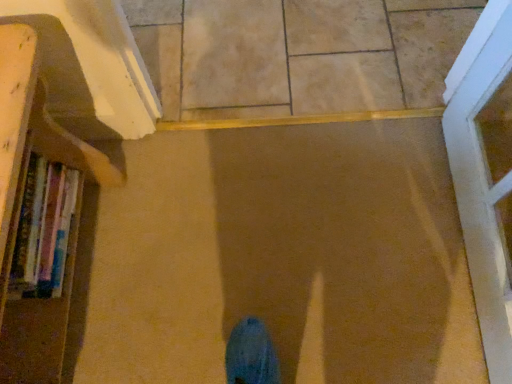
Question: Is hardcover books at left bigger than wooden bookshelf at left?

Choices:
 (A) yes
 (B) no

Answer: (B)

Question: Can we say hardcover books at left lies outside wooden bookshelf at left?

Choices:
 (A) yes
 (B) no

Answer: (B)

Question: From the image's perspective, does hardcover books at left appear lower than wooden bookshelf at left?

Choices:
 (A) yes
 (B) no

Answer: (B)

Question: Does hardcover books at left have a lesser height compared to wooden bookshelf at left?

Choices:
 (A) no
 (B) yes

Answer: (B)

Question: Is hardcover books at left turned away from wooden bookshelf at left?

Choices:
 (A) yes
 (B) no

Answer: (A)

Question: Are hardcover books at left and wooden bookshelf at left beside each other?

Choices:
 (A) yes
 (B) no

Answer: (A)

Question: Considering the relative sizes of wooden bookshelf at left and beige tile at center in the image provided, is wooden bookshelf at left smaller than beige tile at center?

Choices:
 (A) no
 (B) yes

Answer: (A)

Question: Does wooden bookshelf at left appear on the right side of beige tile at center?

Choices:
 (A) no
 (B) yes

Answer: (A)

Question: From a real-world perspective, is wooden bookshelf at left on beige tile at center?

Choices:
 (A) yes
 (B) no

Answer: (A)

Question: Is wooden bookshelf at left beside beige tile at center?

Choices:
 (A) yes
 (B) no

Answer: (B)

Question: Is wooden bookshelf at left not inside beige tile at center?

Choices:
 (A) no
 (B) yes

Answer: (B)

Question: Is wooden bookshelf at left aimed at beige tile at center?

Choices:
 (A) no
 (B) yes

Answer: (A)

Question: From a real-world perspective, is wooden bookshelf at left beneath hardcover books at left?

Choices:
 (A) no
 (B) yes

Answer: (A)